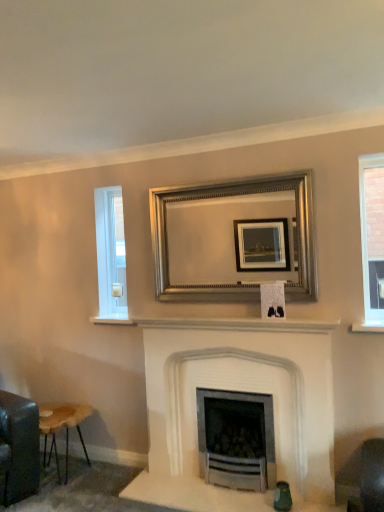
At what (x,y) coordinates should I click in order to perform the action: click on vacant space underneath silver/golden metallic picture frame at center (from a real-world perspective). Please return your answer as a coordinate pair (x, y). Image resolution: width=384 pixels, height=512 pixels. Looking at the image, I should click on (240, 316).